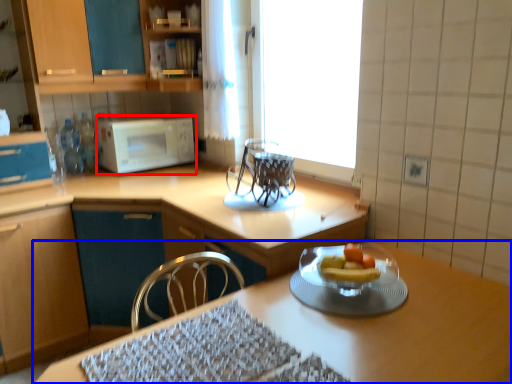
Question: Among these objects, which one is nearest to the camera, microwave oven (highlighted by a red box) or table (highlighted by a blue box)?

Choices:
 (A) microwave oven
 (B) table

Answer: (B)